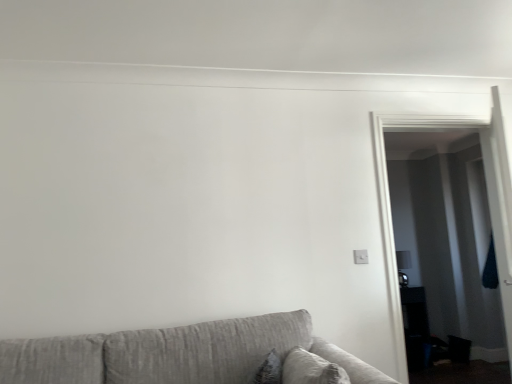
Question: Considering the positions of point (378, 215) and point (169, 360), is point (378, 215) closer or farther from the camera than point (169, 360)?

Choices:
 (A) farther
 (B) closer

Answer: (A)

Question: Is transparent glass door at right inside the boundaries of textured gray couch at lower left, or outside?

Choices:
 (A) inside
 (B) outside

Answer: (B)

Question: Would you say transparent glass door at right is to the left or to the right of textured gray couch at lower left in the picture?

Choices:
 (A) left
 (B) right

Answer: (B)

Question: In terms of size, does textured gray couch at lower left appear bigger or smaller than transparent glass door at right?

Choices:
 (A) small
 (B) big

Answer: (B)

Question: Choose the correct answer: Is textured gray couch at lower left inside transparent glass door at right or outside it?

Choices:
 (A) inside
 (B) outside

Answer: (B)

Question: From their relative heights in the image, would you say textured gray couch at lower left is taller or shorter than transparent glass door at right?

Choices:
 (A) short
 (B) tall

Answer: (A)

Question: From a real-world perspective, relative to transparent glass door at right, is textured gray couch at lower left vertically above or below?

Choices:
 (A) above
 (B) below

Answer: (B)